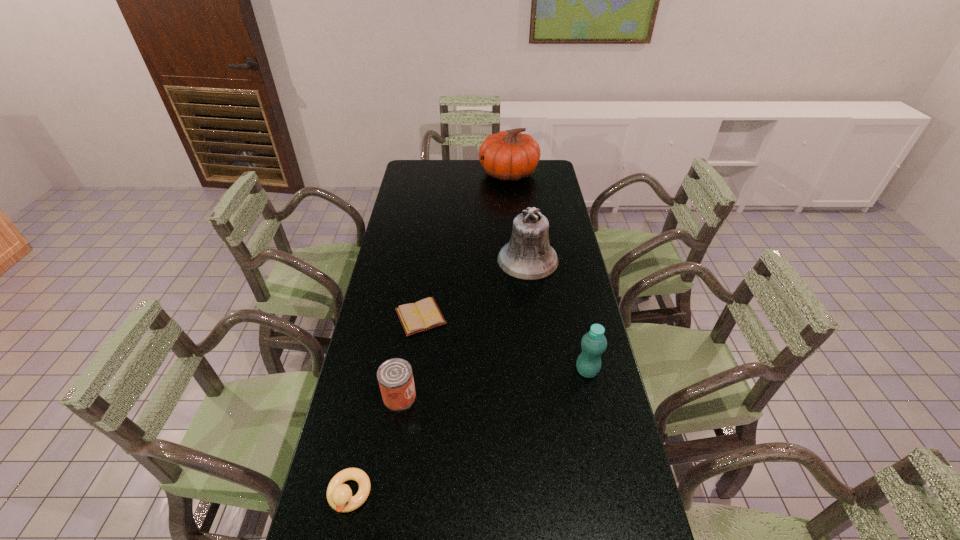
This screenshot has height=540, width=960. Find the location of `vacant area at the far right corner of the desktop`. vacant area at the far right corner of the desktop is located at coordinates (546, 175).

The height and width of the screenshot is (540, 960). Find the location of `vacant area between the pumpkin and the third farthest object`. vacant area between the pumpkin and the third farthest object is located at coordinates (465, 245).

You are a GUI agent. You are given a task and a screenshot of the screen. Output one action in this format:
    pyautogui.click(x=<x>, y=<y>)
    Task: Click on the unoccupied area between the bell and the second shortest object
    The width and height of the screenshot is (960, 540).
    Given the screenshot: What is the action you would take?
    pyautogui.click(x=439, y=377)

The height and width of the screenshot is (540, 960). What are the coordinates of `vacant space that's between the fourth tallest object and the fifth nearest object` in the screenshot? It's located at pyautogui.click(x=464, y=328).

Locate an element on the screen. vacant space that is in between the third nearest object and the bell is located at coordinates (558, 315).

Locate an element on the screen. The height and width of the screenshot is (540, 960). free spot between the bell and the can is located at coordinates (464, 328).

Where is `blank region between the third farthest object and the farthest object`? The width and height of the screenshot is (960, 540). blank region between the third farthest object and the farthest object is located at coordinates (465, 245).

This screenshot has height=540, width=960. I want to click on free space between the fourth shortest object and the fourth nearest object, so click(504, 344).

The height and width of the screenshot is (540, 960). I want to click on blank region between the can and the bell, so click(x=464, y=328).

This screenshot has height=540, width=960. What are the coordinates of `free space between the third shortest object and the fourth nearest object` in the screenshot? It's located at (410, 356).